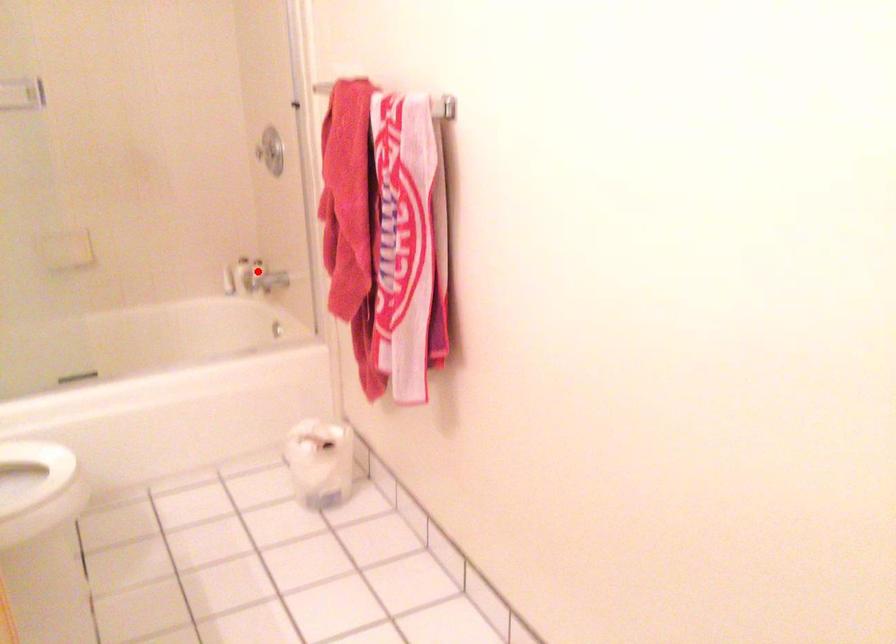
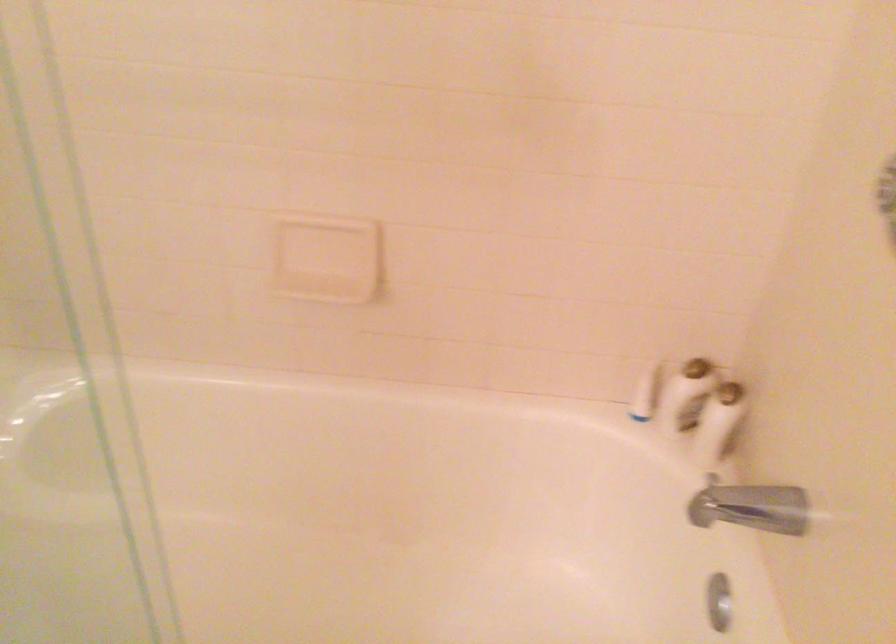
Question: I am providing you with two images of the same scene from different viewpoints. Image1 has a red point marked. In image2, the corresponding 3D location appears at what relative position? Reply with the corresponding letter.

Choices:
 (A) Closer
 (B) Farther

Answer: (A)